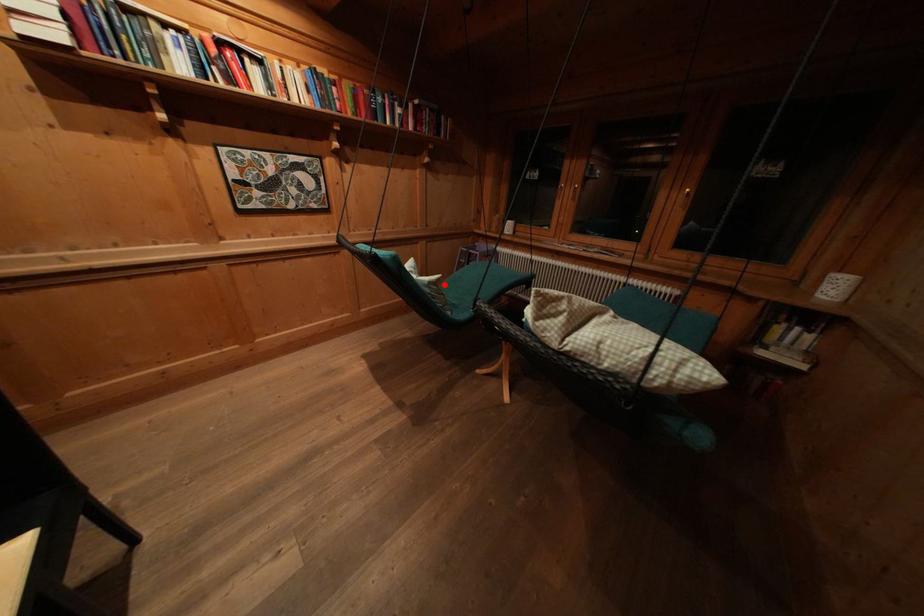
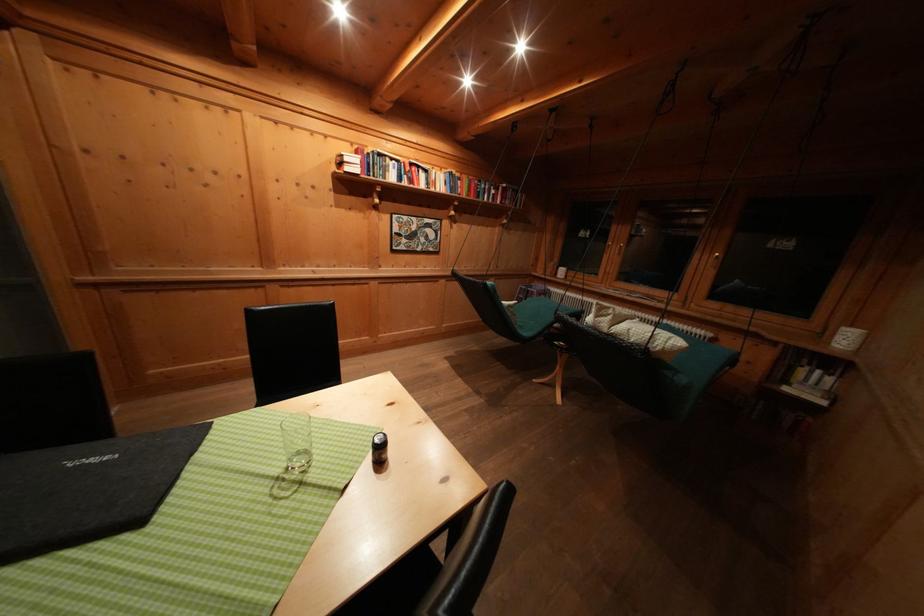
The point at the highlighted location is marked in the first image. Where is the corresponding point in the second image?

(520, 309)